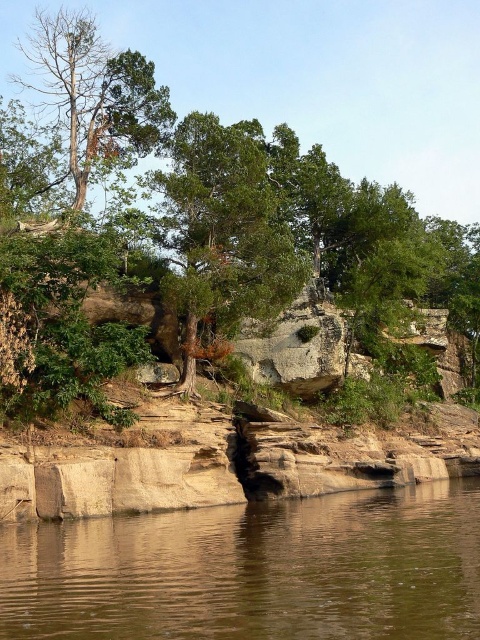
You are a hiker trying to determine which tree has a thicker trunk between the green matte tree at center and the dead brown tree at upper left. Based on the scene, which one should you choose?

The dead brown tree at upper left has a thicker trunk than the green matte tree at center.

You are standing on the rocky shoreline and want to take a photo of the dead brown tree at upper left and the brown smooth water at lower center. Which object will appear larger in the photo if you focus on them equally?

The dead brown tree at upper left will appear larger in the photo because it has a greater height than the brown smooth water at lower center.